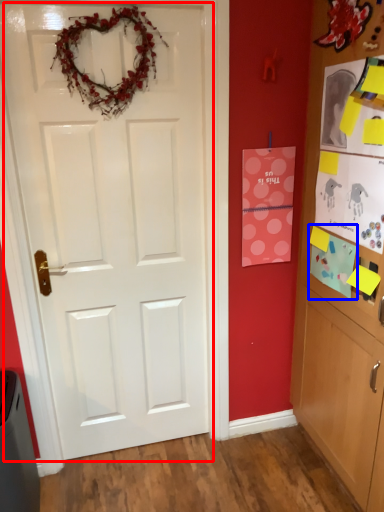
Question: Which object appears farthest to the camera in this image, door (highlighted by a red box) or postcard (highlighted by a blue box)?

Choices:
 (A) door
 (B) postcard

Answer: (B)